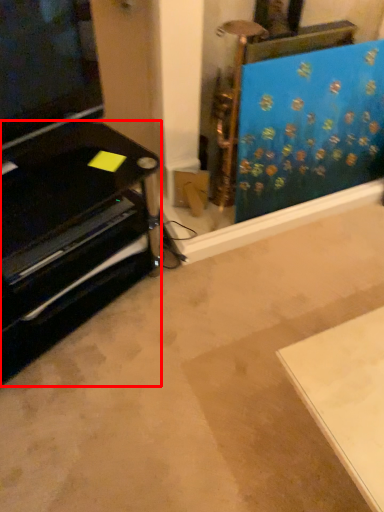
Question: From the image's perspective, what is the correct spatial positioning of furniture (annotated by the red box) in reference to curtain?

Choices:
 (A) below
 (B) above

Answer: (A)